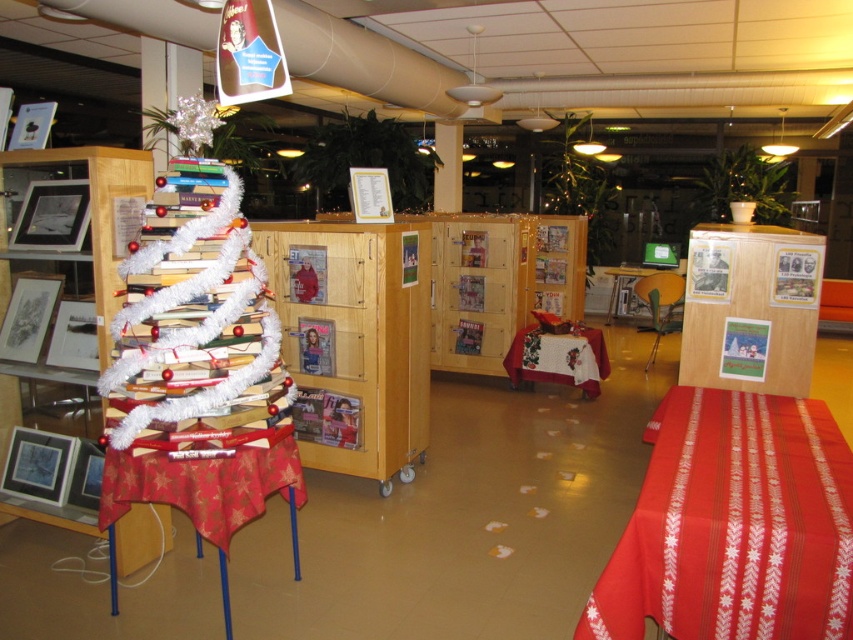
Is white wooden bookshelf at left below red fabric table at left?

Actually, white wooden bookshelf at left is above red fabric table at left.

Is point (15, 189) positioned behind point (201, 490)?

Yes, point (15, 189) is farther from viewer.

The width and height of the screenshot is (853, 640). What do you see at coordinates (68, 298) in the screenshot? I see `white wooden bookshelf at left` at bounding box center [68, 298].

You are a GUI agent. You are given a task and a screenshot of the screen. Output one action in this format:
    pyautogui.click(x=<x>, y=<y>)
    Task: Click on the white wooden bookshelf at left
    Image resolution: width=853 pixels, height=640 pixels.
    Given the screenshot: What is the action you would take?
    pyautogui.click(x=68, y=298)

Does red fabric tablecloth at lower right lie behind green plastic table at center?

No, it is in front of green plastic table at center.

Is point (636, 625) closer to camera compared to point (654, 305)?

Yes, it is.

Where is `red fabric tablecloth at lower right`? The image size is (853, 640). red fabric tablecloth at lower right is located at coordinates (733, 524).

Is red fabric tablecloth at lower right further to the viewer compared to red fabric table at left?

No, it is not.

Does red fabric tablecloth at lower right have a greater height compared to red fabric table at left?

In fact, red fabric tablecloth at lower right may be shorter than red fabric table at left.

Describe the element at coordinates (733, 524) in the screenshot. Image resolution: width=853 pixels, height=640 pixels. I see `red fabric tablecloth at lower right` at that location.

The height and width of the screenshot is (640, 853). I want to click on red fabric tablecloth at lower right, so click(733, 524).